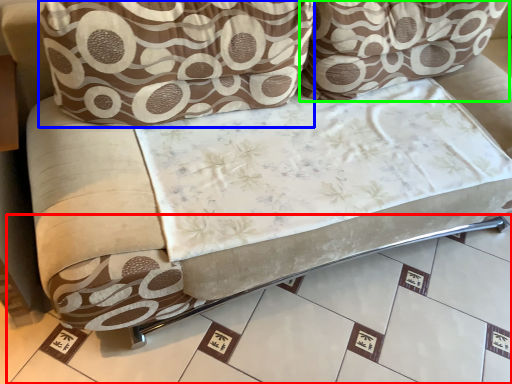
Question: Which is farther away from tile (highlighted by a red box)? throw pillow (highlighted by a blue box) or throw pillow (highlighted by a green box)?

Choices:
 (A) throw pillow
 (B) throw pillow

Answer: (B)